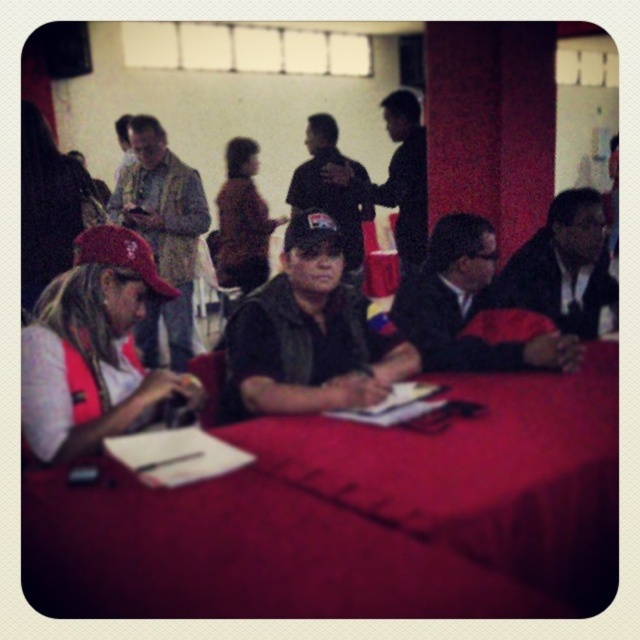
Can you confirm if matte red cap at lower left is wider than red cap at left?

Yes.

Does matte red cap at lower left have a lesser width compared to red cap at left?

No.

Does point (104, 250) come closer to viewer compared to point (26, 180)?

Yes, it is in front of point (26, 180).

At what (x,y) coordinates should I click in order to perform the action: click on matte red cap at lower left. Please return your answer as a coordinate pair (x, y). Looking at the image, I should click on (93, 348).

Does matte black cap at center appear under dark blue fabric cap at center?

Indeed, matte black cap at center is positioned under dark blue fabric cap at center.

Does matte black cap at center have a larger size compared to dark blue fabric cap at center?

No, matte black cap at center is not bigger than dark blue fabric cap at center.

Find the location of `matte black cap at center`. matte black cap at center is located at coordinates point(308,336).

Does point (113, 268) lie behind point (458, 248)?

No, (113, 268) is closer to viewer.

Between point (65, 280) and point (458, 212), which one is positioned in front?

Point (65, 280) is in front.

Is point (120, 388) more distant than point (460, 266)?

No, it is in front of (460, 266).

What are the coordinates of `matte red cap at lower left` in the screenshot? It's located at (93, 348).